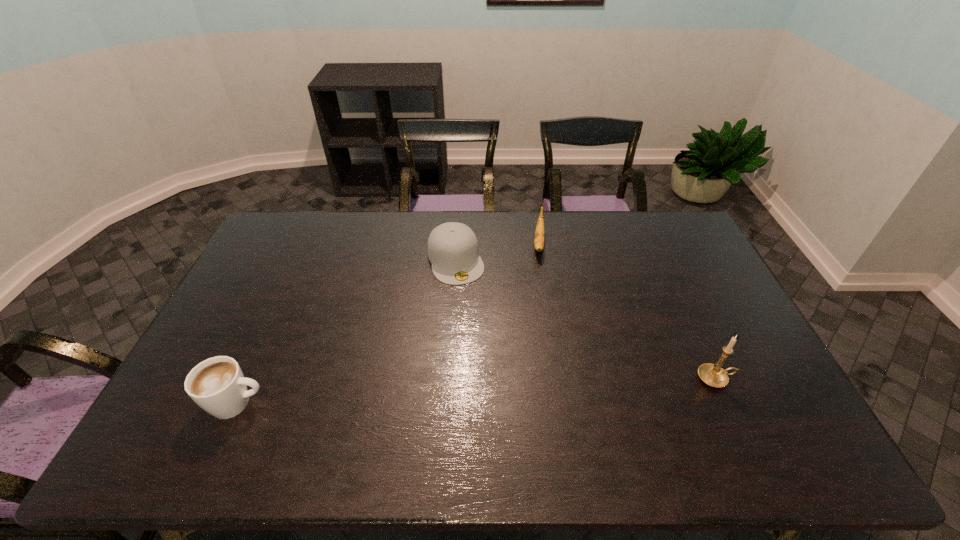
Identify the location of free spot on the desktop that is between the leftmost object and the candle holder and is positioned on the peel of the third object from left to right from the top. (531, 388).

Where is `free space on the desktop that is between the cappuccino and the rightmost object and is positioned on the front-facing side of the cap`? The image size is (960, 540). free space on the desktop that is between the cappuccino and the rightmost object and is positioned on the front-facing side of the cap is located at coordinates (503, 389).